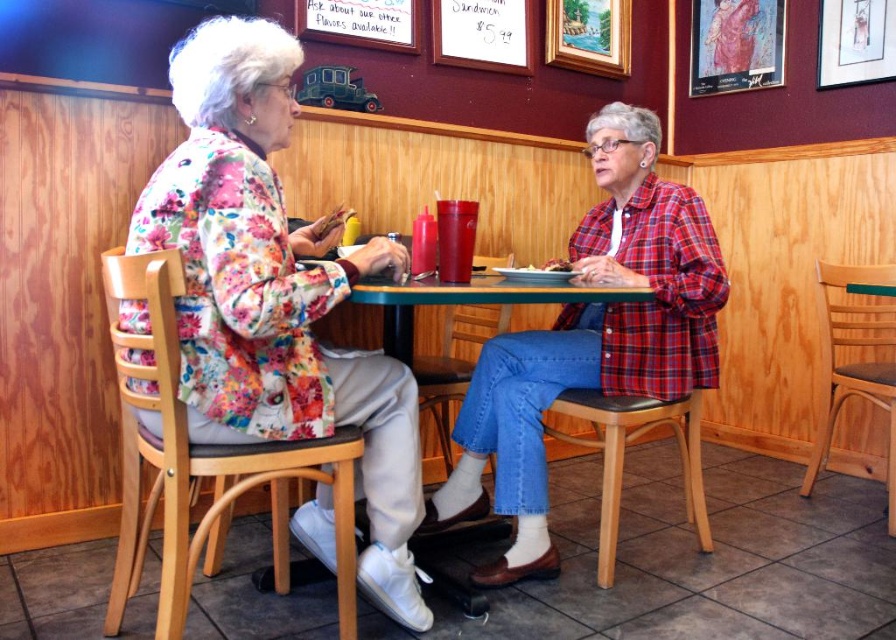
You are a photographer standing in front of the wooden stool at lower center and the wooden picture frame at upper right. You want to take a photo that includes both objects but focuses on the stool. Where should you position yourself relative to the stool and the frame?

To capture both the wooden stool at lower center and the wooden picture frame at upper right while focusing on the stool, position yourself so that the stool is centered in your viewfinder and the picture frame is placed above it. This arrangement maintains the stool as the focal point while including the frame in the upper part of the photo.